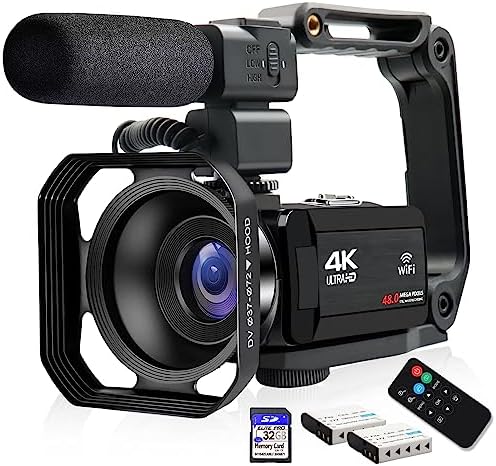
Locate an element on the screen. hinge is located at coordinates (449, 297).